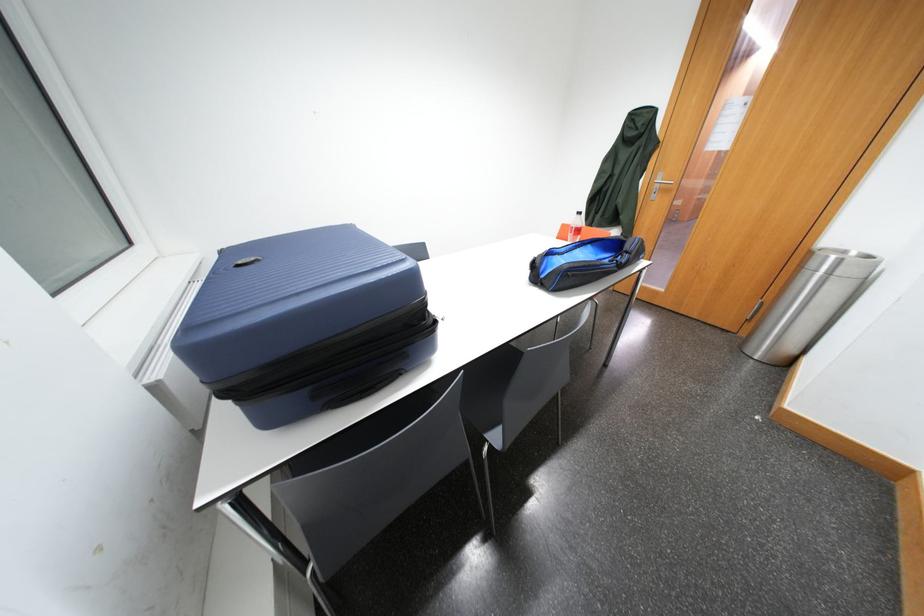
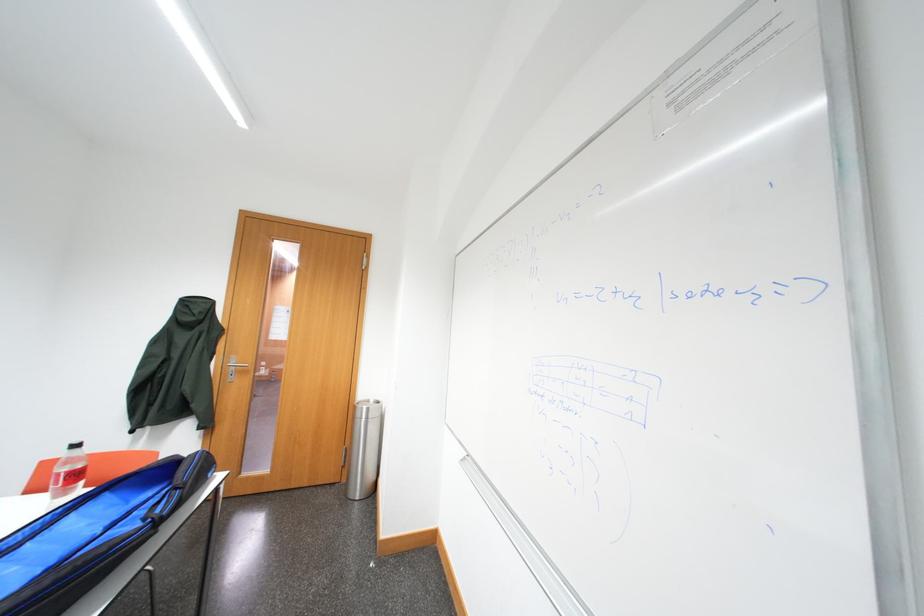
Question: How did the camera likely rotate?

Choices:
 (A) Left
 (B) Right
 (C) Up
 (D) Down

Answer: (B)